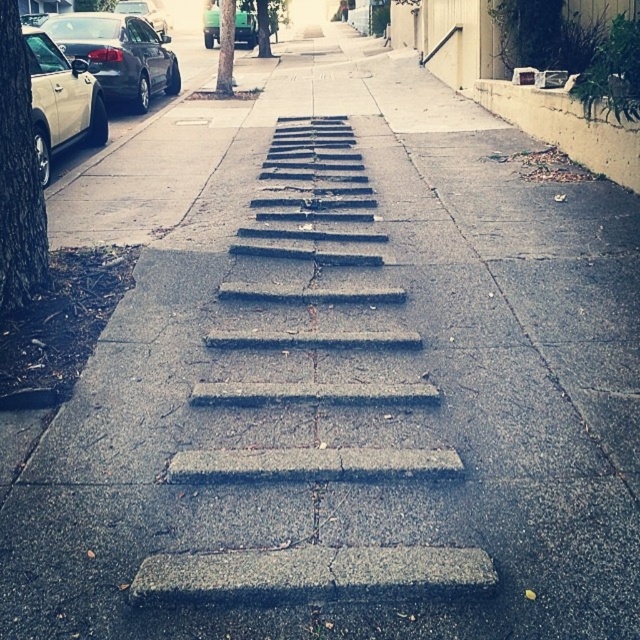
Question: Can you confirm if shiny black sedan at left is bigger than matte silver car at left?

Choices:
 (A) yes
 (B) no

Answer: (B)

Question: Which of these objects is positioned farthest from the green rough bark tree at center?

Choices:
 (A) gray concrete steps at center
 (B) gray concrete curb at upper right

Answer: (A)

Question: Does gray concrete curb at upper right appear on the left side of green matte truck at upper center?

Choices:
 (A) yes
 (B) no

Answer: (B)

Question: Among these points, which one is nearest to the camera?

Choices:
 (A) (339, 440)
 (B) (609, 141)
 (C) (58, 32)

Answer: (A)

Question: Does gray concrete steps at center lie in front of green leafy tree at left?

Choices:
 (A) yes
 (B) no

Answer: (A)

Question: Which object appears farthest from the camera in this image?

Choices:
 (A) shiny black sedan at left
 (B) gray concrete steps at center
 (C) shiny black sedan at upper left

Answer: (C)